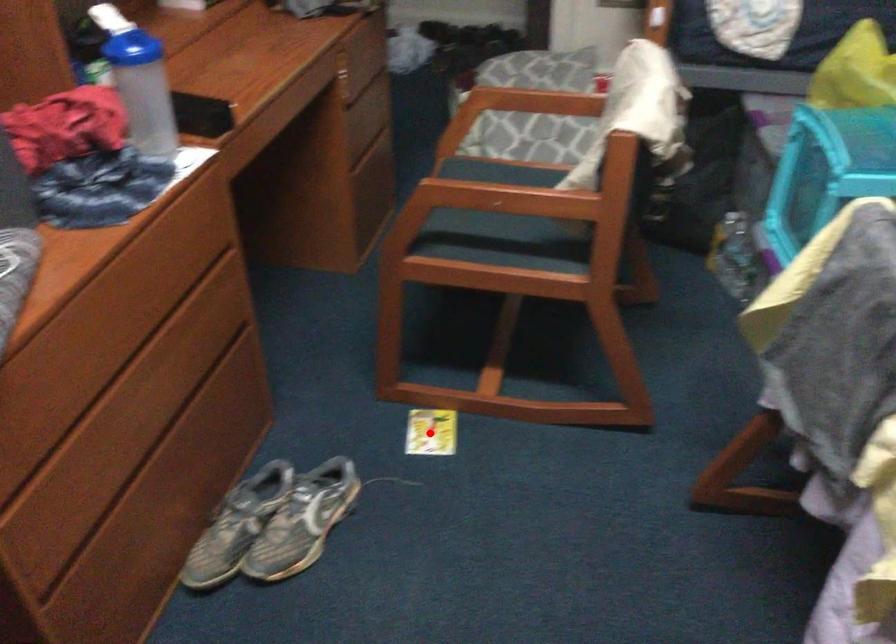
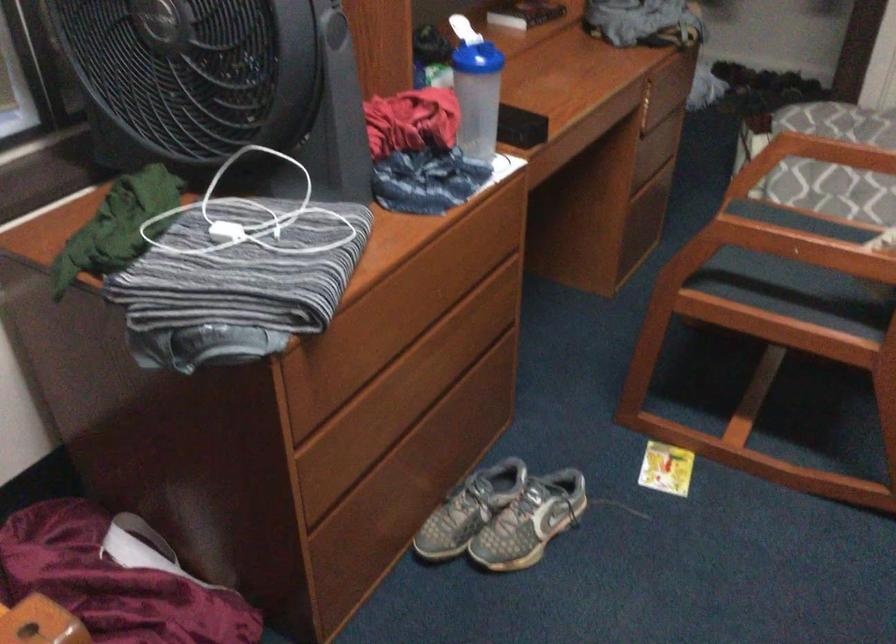
The point at the highlighted location is marked in the first image. Where is the corresponding point in the second image?

(666, 468)